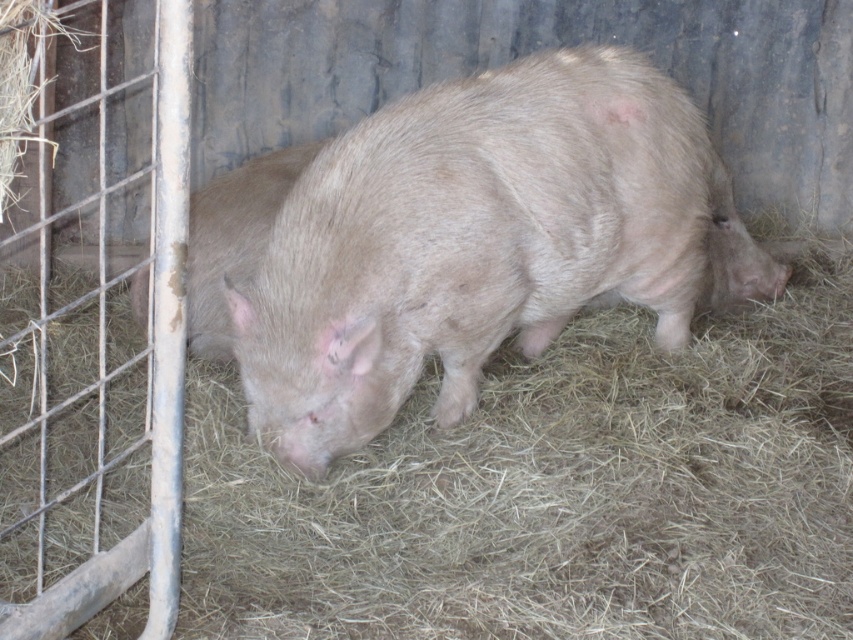
Does fuzzy brown pig at center have a smaller size compared to fuzzy pink pig at center?

No, fuzzy brown pig at center is not smaller than fuzzy pink pig at center.

The height and width of the screenshot is (640, 853). Identify the location of fuzzy brown pig at center. (482, 241).